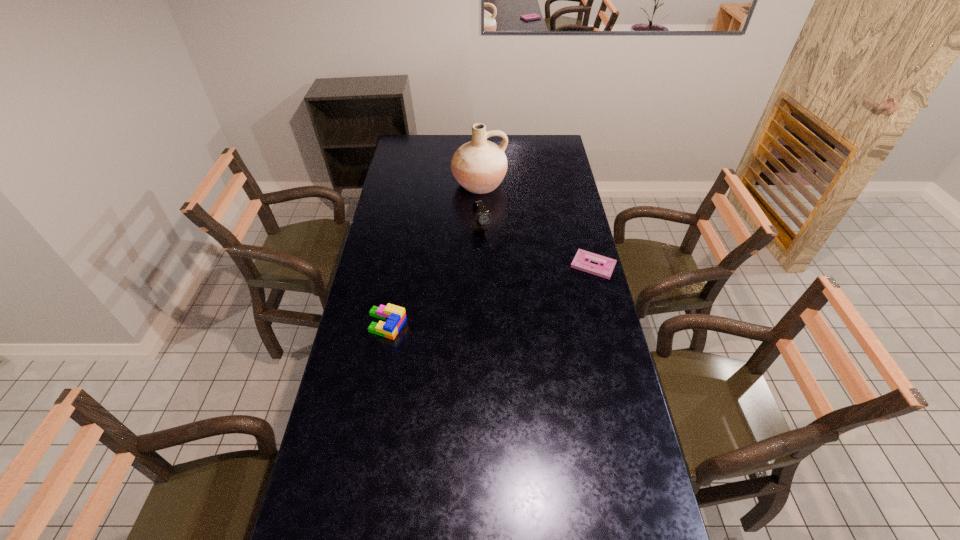
This screenshot has height=540, width=960. I want to click on free spot on the desktop that is between the Lego and the second nearest object and is positioned to pour from the handle of the pottery, so click(x=519, y=286).

The width and height of the screenshot is (960, 540). Find the location of `vacant spot on the desktop that is between the Lego and the shortest object and is positioned on the face of the third shortest object`. vacant spot on the desktop that is between the Lego and the shortest object and is positioned on the face of the third shortest object is located at coordinates (521, 286).